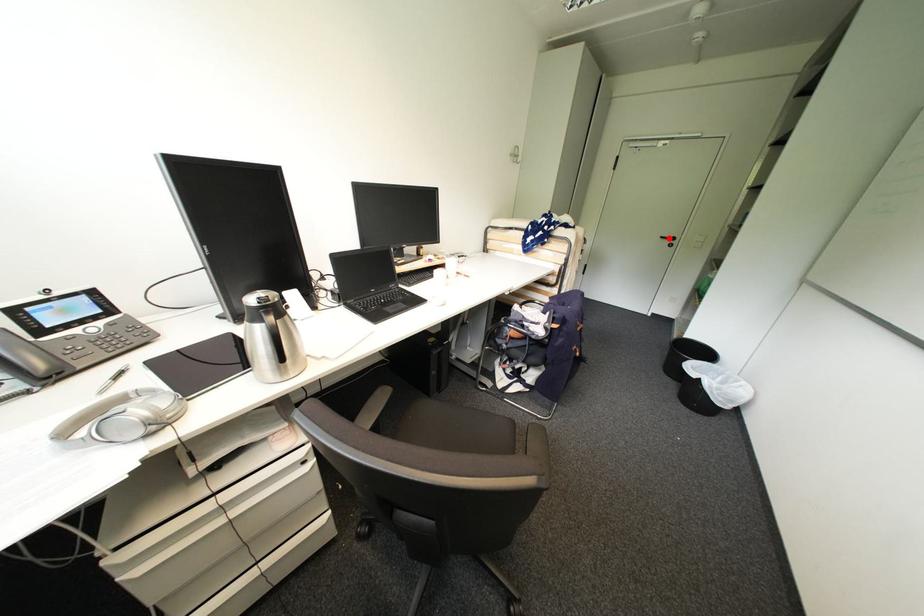
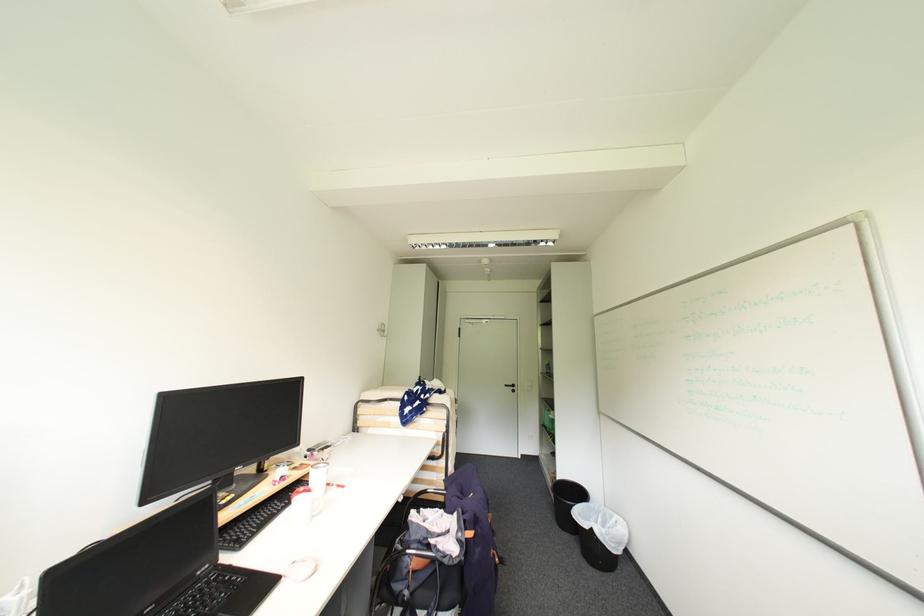
Locate, in the second image, the point that corresponds to the highlighted location in the first image.

(513, 387)